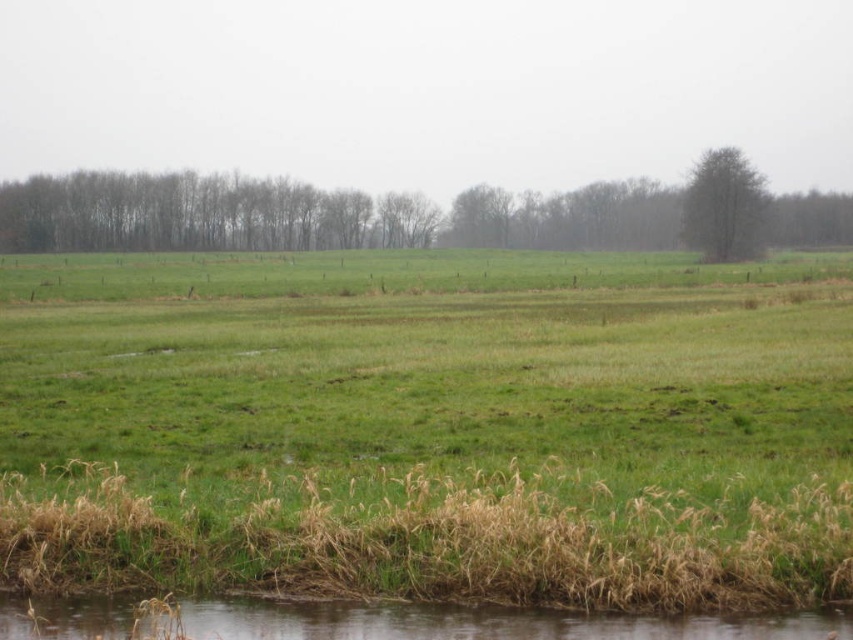
Which is behind, point (590, 490) or point (548, 632)?

The point (590, 490) is behind.

Does green grassy at lower left have a greater width compared to green grassy river at lower center?

Yes.

Does point (775, 412) come closer to viewer compared to point (419, 628)?

No, it is behind (419, 628).

Image resolution: width=853 pixels, height=640 pixels. What are the coordinates of `green grassy at lower left` in the screenshot? It's located at (428, 428).

Does point (219, 611) come behind point (769, 241)?

No, (219, 611) is closer to viewer.

Is green grassy river at lower center shorter than green leafy tree at upper right?

Yes, green grassy river at lower center is shorter than green leafy tree at upper right.

Is point (389, 627) less distant than point (844, 211)?

Yes, it is in front of point (844, 211).

Where is `green grassy river at lower center`? green grassy river at lower center is located at coordinates (480, 621).

Can you confirm if green grassy river at lower center is positioned to the left of green leafy tree at center?

No, green grassy river at lower center is not to the left of green leafy tree at center.

Who is taller, green grassy river at lower center or green leafy tree at center?

green leafy tree at center is taller.

Which is in front, point (45, 608) or point (424, 225)?

Point (45, 608) is in front.

This screenshot has width=853, height=640. Identify the location of green grassy river at lower center. (480, 621).